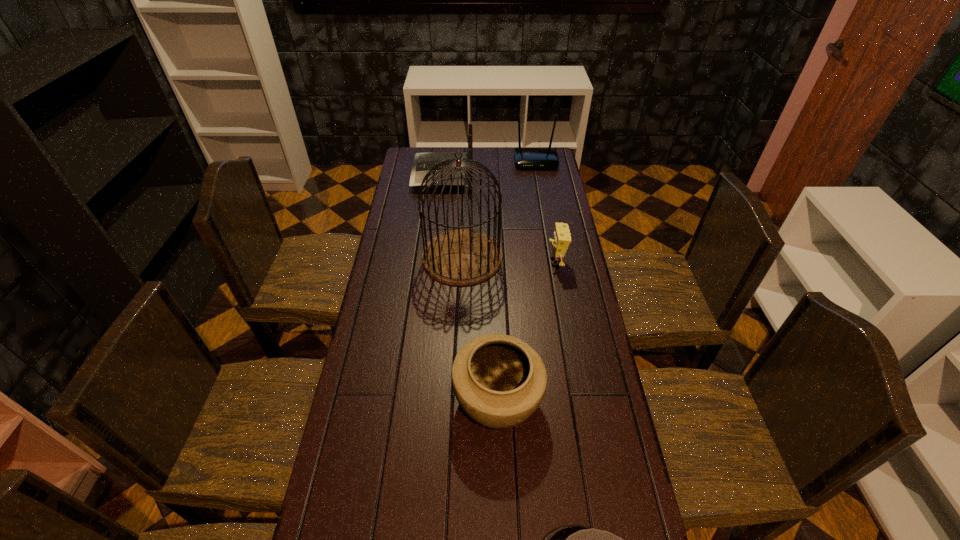
Locate an element on the screen. The image size is (960, 540). free point that satisfies the following two spatial constraints: 1. at the door of the tallest object; 2. on the right side of the pottery is located at coordinates (456, 400).

Image resolution: width=960 pixels, height=540 pixels. In order to click on free region that satisfies the following two spatial constraints: 1. on the front-facing side of the left router; 2. on the back side of the pottery in this screenshot , I will do [x=419, y=400].

Where is `free space in the image that satisfies the following two spatial constraints: 1. on the front-facing side of the pottery; 2. on the right side of the left router`? free space in the image that satisfies the following two spatial constraints: 1. on the front-facing side of the pottery; 2. on the right side of the left router is located at coordinates (419, 400).